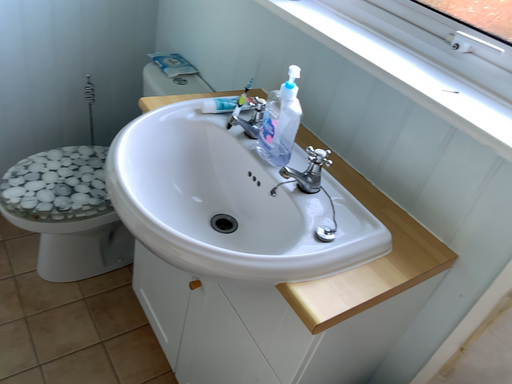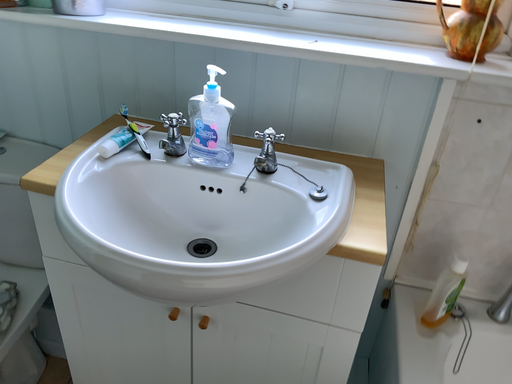
Question: Which way did the camera rotate in the video?

Choices:
 (A) rotated upward
 (B) rotated downward

Answer: (A)